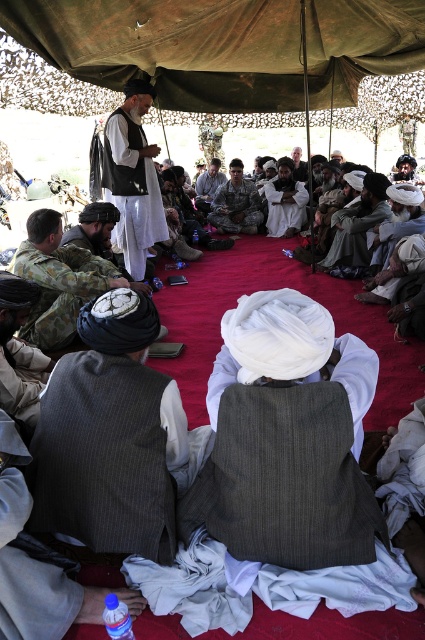
Which is in front, point (19, 285) or point (282, 209)?

Point (19, 285)

Who is higher up, dark gray fabric vest at lower left or white cotton turban at center?

white cotton turban at center is above.

Where is `dark gray fabric vest at lower left`? This screenshot has width=425, height=640. dark gray fabric vest at lower left is located at coordinates (19, 352).

Consider the image. Who is taller, camouflage uniform at center or blue plastic bottle at lower left?

camouflage uniform at center

Is camouflage uniform at center thinner than blue plastic bottle at lower left?

In fact, camouflage uniform at center might be wider than blue plastic bottle at lower left.

At what (x,y) coordinates should I click in order to perform the action: click on camouflage uniform at center. Please return your answer as a coordinate pair (x, y). Image resolution: width=425 pixels, height=640 pixels. Looking at the image, I should click on (235, 204).

Where is `camouflage uniform at center`? The height and width of the screenshot is (640, 425). camouflage uniform at center is located at coordinates point(235,204).

Can you confirm if gray woolen vest at center is positioned to the right of camouflage uniform at center?

No, gray woolen vest at center is not to the right of camouflage uniform at center.

Does gray woolen vest at center appear over camouflage uniform at center?

Actually, gray woolen vest at center is below camouflage uniform at center.

The image size is (425, 640). Describe the element at coordinates (110, 442) in the screenshot. I see `gray woolen vest at center` at that location.

Find the location of `gray woolen vest at center`. gray woolen vest at center is located at coordinates (110, 442).